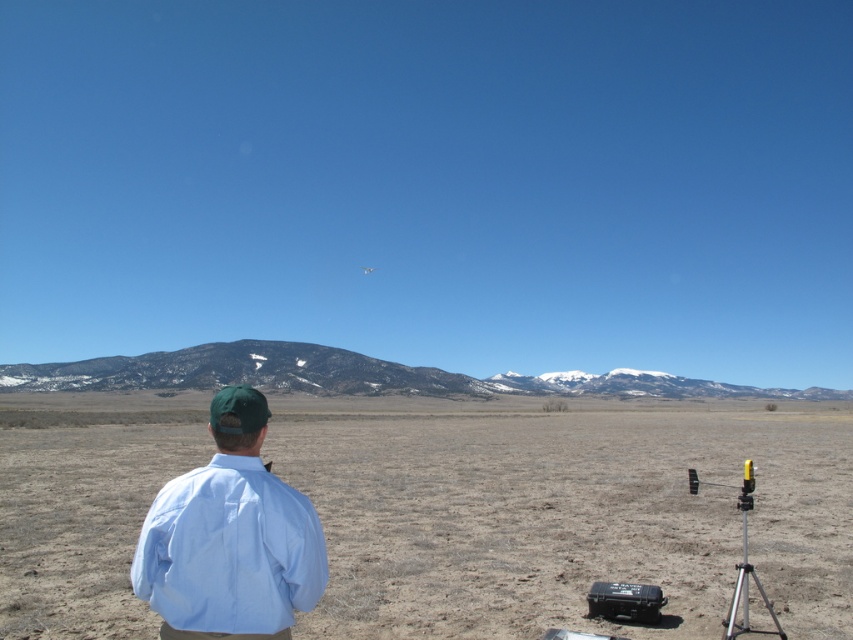
Is light blue cotton shirt at center bigger than silver metallic tripod at lower right?

Yes.

Who is lower down, light blue cotton shirt at center or silver metallic tripod at lower right?

light blue cotton shirt at center is below.

Image resolution: width=853 pixels, height=640 pixels. Identify the location of light blue cotton shirt at center. (230, 538).

Does brown/dry grass at center appear on the left side of silver metallic tripod at lower right?

No, brown/dry grass at center is not to the left of silver metallic tripod at lower right.

Describe the element at coordinates (566, 512) in the screenshot. I see `brown/dry grass at center` at that location.

Is point (817, 625) closer to viewer compared to point (769, 605)?

Yes.

This screenshot has height=640, width=853. I want to click on brown/dry grass at center, so click(x=566, y=512).

Between point (397, 582) and point (212, 486), which one is positioned in front?

Point (212, 486)

This screenshot has width=853, height=640. What do you see at coordinates (566, 512) in the screenshot?
I see `brown/dry grass at center` at bounding box center [566, 512].

Locate an element on the screen. The image size is (853, 640). brown/dry grass at center is located at coordinates (566, 512).